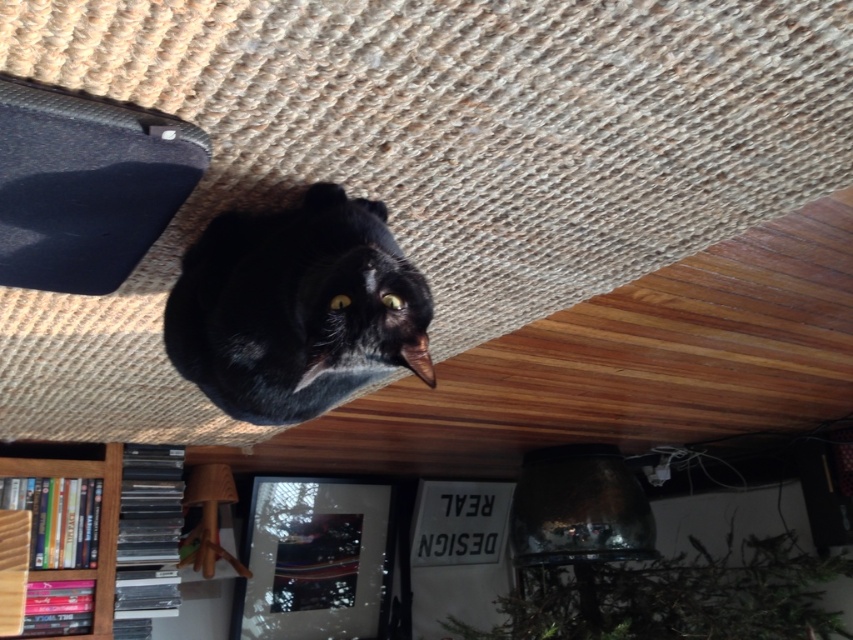
Where is the black matte cat at center located in the image?

The black matte cat at center is located at point coordinates of (296, 307).

You are standing in the room and want to place a small plant pot exactly at the point marked as point (296, 307). However, there is a black matte cat at center currently occupying that location. Can you place the plant pot there without disturbing the cat?

The black matte cat at center is located at point (296, 307), so you cannot place the plant pot there without moving the cat.

You are a delivery robot that is 2 feet wide. You need to move from the entrance to the wooden bookshelf at lower left while avoiding the black matte cat at center. Can you safely pass between them without getting too close?

The black matte cat at center is 4.48 feet away from the wooden bookshelf at lower left. Since the robot is 2 feet wide, there is enough space between them to safely navigate around the cat and reach the bookshelf.